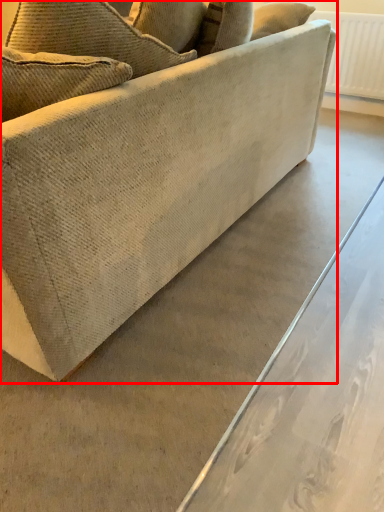
Question: From the image's perspective, considering the relative positions of studio couch (annotated by the red box) and radiator in the image provided, where is studio couch (annotated by the red box) located with respect to the staircase?

Choices:
 (A) below
 (B) above

Answer: (A)